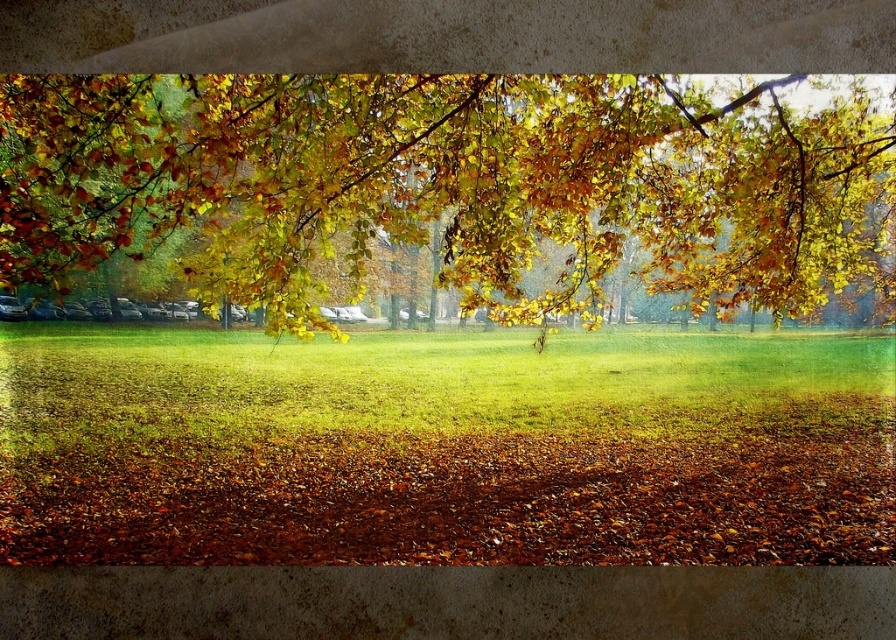
You are standing at the edge of the lawn looking towards the trees. There are two points marked in the scene, point (247,90) and point (831,419). Which point is nearer to you?

Point (247,90) is closer to the viewer than point (831,419).